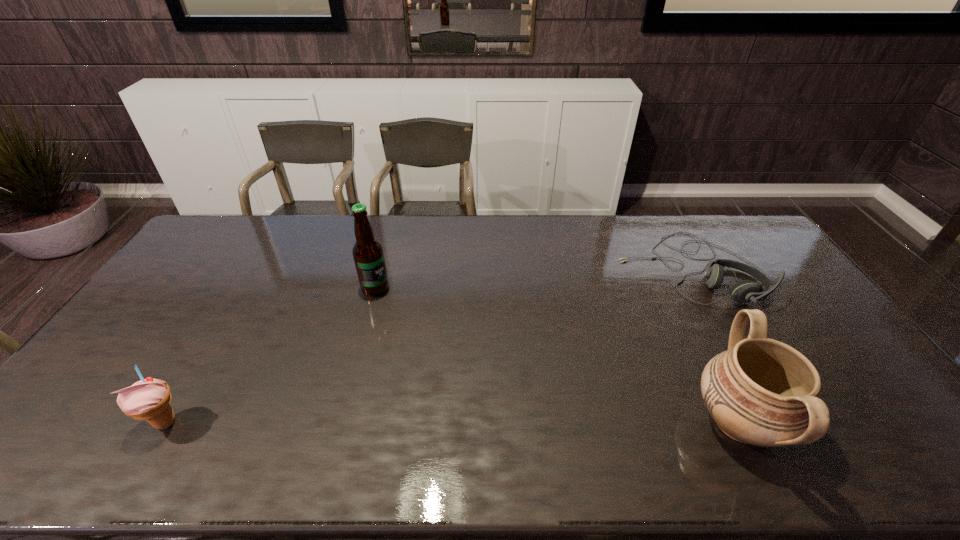
The width and height of the screenshot is (960, 540). In order to click on empty location between the shortest object and the third shortest object in this screenshot , I will do `click(714, 345)`.

Where is `free space that is in between the icecream and the urn`? This screenshot has height=540, width=960. free space that is in between the icecream and the urn is located at coordinates (452, 422).

Locate an element on the screen. unoccupied area between the icecream and the shortest object is located at coordinates (428, 346).

You are a GUI agent. You are given a task and a screenshot of the screen. Output one action in this format:
    pyautogui.click(x=<x>, y=<y>)
    Task: Click on the free space between the beer bottle and the leftmost object
    The width and height of the screenshot is (960, 540).
    Given the screenshot: What is the action you would take?
    pyautogui.click(x=271, y=355)

Identify the location of vacant region between the shortest object and the second tallest object. (714, 345).

Where is `vacant space in between the beer bottle and the urn`? The width and height of the screenshot is (960, 540). vacant space in between the beer bottle and the urn is located at coordinates (557, 355).

This screenshot has width=960, height=540. In order to click on free spot between the headset and the second shortest object in this screenshot , I will do `click(428, 346)`.

Where is `free point between the shortest object and the second tallest object`? free point between the shortest object and the second tallest object is located at coordinates (714, 345).

Locate an element on the screen. This screenshot has height=540, width=960. object that ranks as the second closest to the headset is located at coordinates (368, 255).

Image resolution: width=960 pixels, height=540 pixels. Identify the location of object that stands as the closest to the second shortest object. (368, 255).